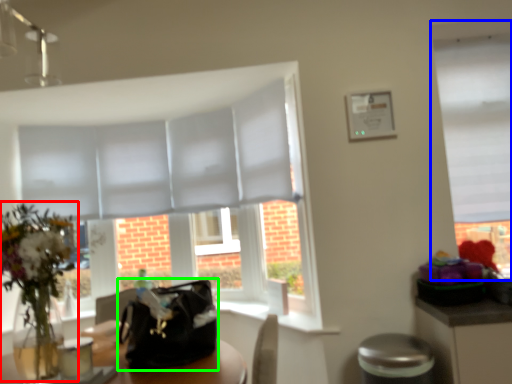
Question: Which object is positioned farthest from floral arrangement (highlighted by a red box)? Select from window (highlighted by a blue box) and handbag (highlighted by a green box).

Choices:
 (A) window
 (B) handbag

Answer: (A)